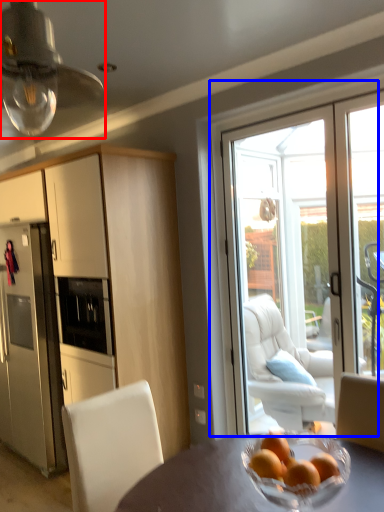
Question: Which object appears closest to the camera in this image, light fixture (highlighted by a red box) or door (highlighted by a blue box)?

Choices:
 (A) light fixture
 (B) door

Answer: (A)